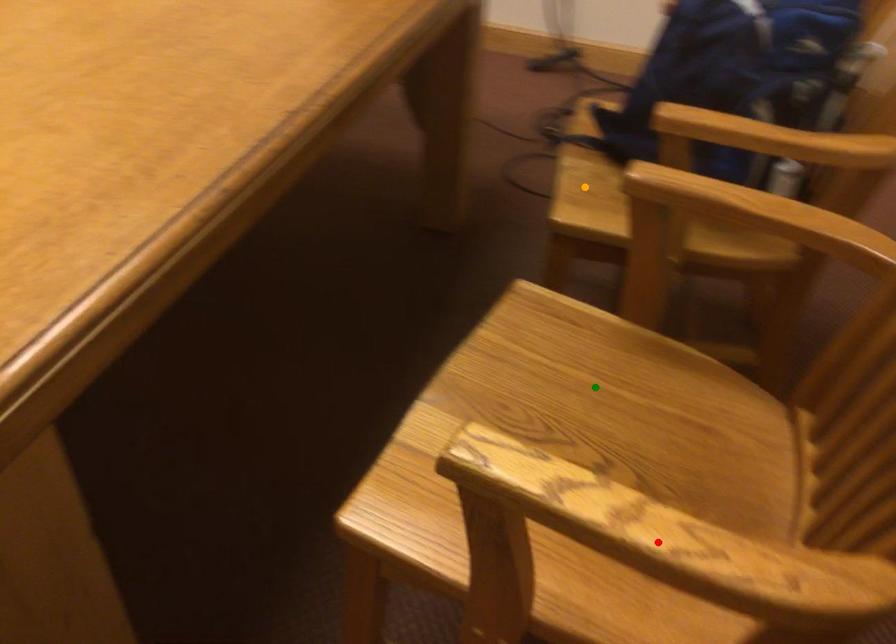
Order these from nearest to farthest:
1. red point
2. orange point
3. green point

red point < green point < orange point